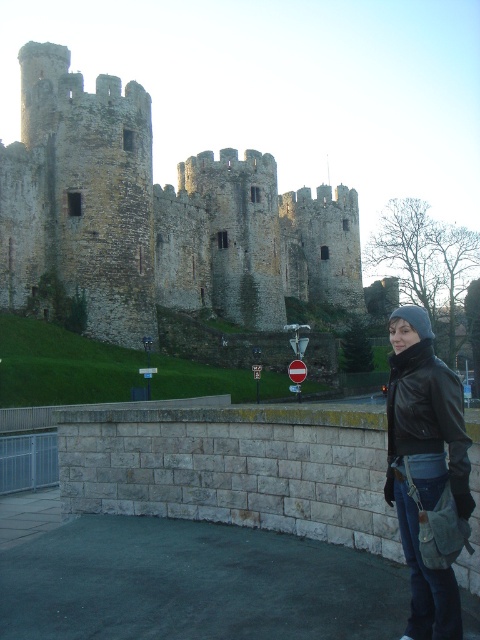
You are standing in front of the weathered stone castle at upper left and the black leather jacket at lower right. Which object is located more to the left side of the scene?

The weathered stone castle at upper left is positioned on the left side of the black leather jacket at lower right, so it is more to the left side of the scene.

You are a tour guide explaining the castle to visitors. You mention that the weathered stone castle at upper left and the black leather jacket at lower right are visible in the image. Which object is wider?

The weathered stone castle at upper left might be wider than black leather jacket at lower right according to the description.